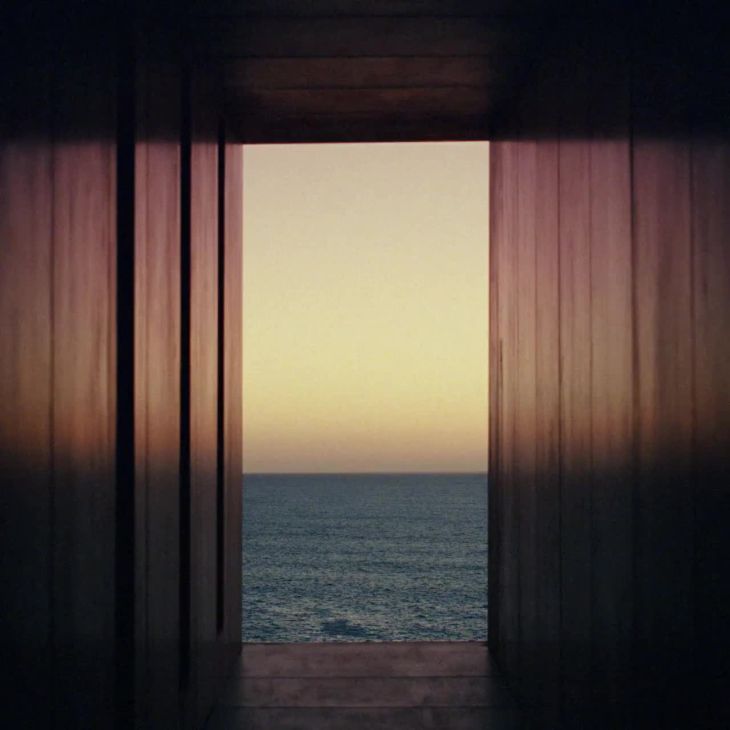
You are a GUI agent. You are given a task and a screenshot of the screen. Output one action in this format:
    pyautogui.click(x=<x>, y=<y>)
    Task: Click on the ceiling
    
    Given the screenshot: What is the action you would take?
    pyautogui.click(x=358, y=49)